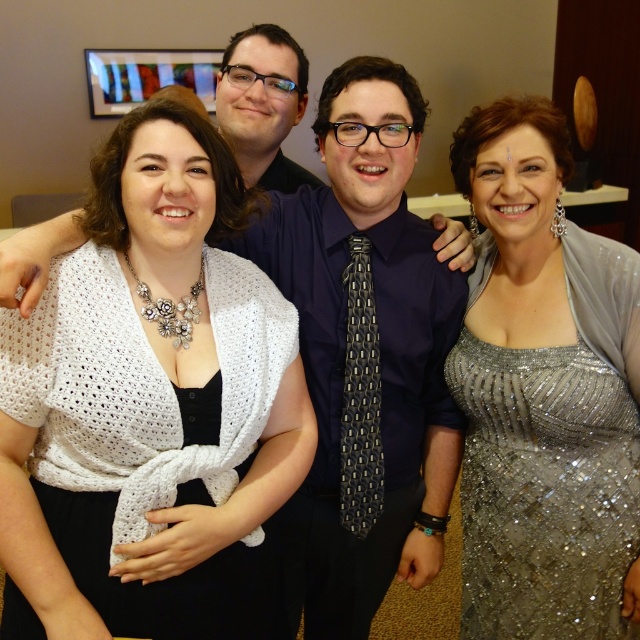
This screenshot has width=640, height=640. What do you see at coordinates (544, 394) in the screenshot?
I see `sparkly silver dress at right` at bounding box center [544, 394].

Is point (577, 472) positioned after point (3, 419)?

That is True.

In order to click on sparkly silver dress at right in this screenshot , I will do `click(544, 394)`.